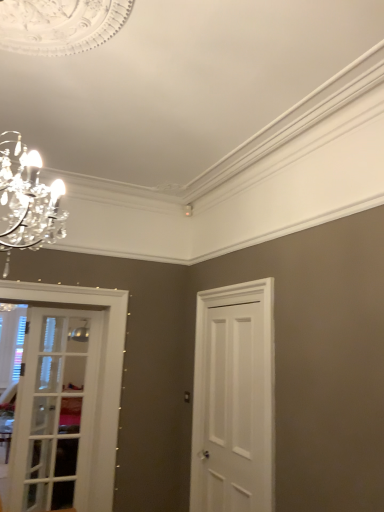
Question: From a real-world perspective, is white glass door at left, the 2th door from the right, positioned above or below white painted wood door at right, arranged as the 1th door when viewed from the right?

Choices:
 (A) above
 (B) below

Answer: (B)

Question: In terms of height, does white glass door at left, the 2th door from the right, look taller or shorter compared to white painted wood door at right, arranged as the 1th door when viewed from the right?

Choices:
 (A) tall
 (B) short

Answer: (B)

Question: Relative to white painted wood door at right, arranged as the 1th door when viewed from the right, is white glass door at left, the 2th door from the right, in front or behind?

Choices:
 (A) front
 (B) behind

Answer: (B)

Question: From a real-world perspective, relative to white glass door at left, which is the 1th door from left to right, is white painted wood door at right, arranged as the 1th door when viewed from the right, vertically above or below?

Choices:
 (A) below
 (B) above

Answer: (B)

Question: Looking at the image, does white painted wood door at right, arranged as the 1th door when viewed from the right, seem bigger or smaller compared to white glass door at left, which is the 1th door from left to right?

Choices:
 (A) small
 (B) big

Answer: (B)

Question: Is point (244, 474) positioned closer to the camera than point (56, 477)?

Choices:
 (A) farther
 (B) closer

Answer: (B)

Question: Which is correct: white painted wood door at right, which is the second door from left to right, is inside white glass door at left, the 2th door from the right, or outside of it?

Choices:
 (A) inside
 (B) outside

Answer: (B)